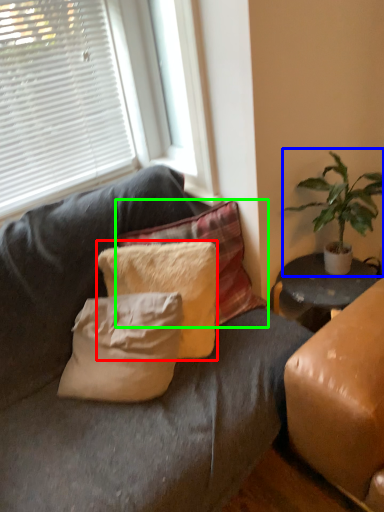
Question: Based on their relative distances, which object is nearer to pillow (highlighted by a red box)? Choose from houseplant (highlighted by a blue box) and pillow (highlighted by a green box).

Choices:
 (A) houseplant
 (B) pillow

Answer: (B)